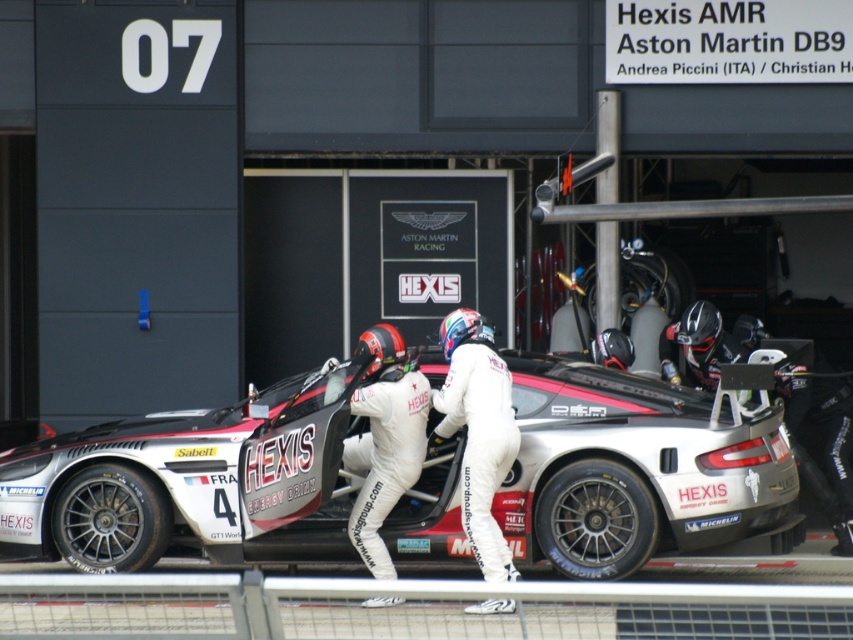
Question: Does white matte sports car at center have a larger size compared to white smooth suit at center?

Choices:
 (A) yes
 (B) no

Answer: (A)

Question: Which of the following is the farthest from the observer?

Choices:
 (A) (340, 412)
 (B) (473, 548)

Answer: (A)

Question: Can you confirm if white matte sports car at center is positioned below white smooth suit at center?

Choices:
 (A) no
 (B) yes

Answer: (B)

Question: Is white matte sports car at center above white smooth suit at center?

Choices:
 (A) no
 (B) yes

Answer: (A)

Question: Among these objects, which one is nearest to the camera?

Choices:
 (A) white matte sports car at center
 (B) white smooth suit at center

Answer: (B)